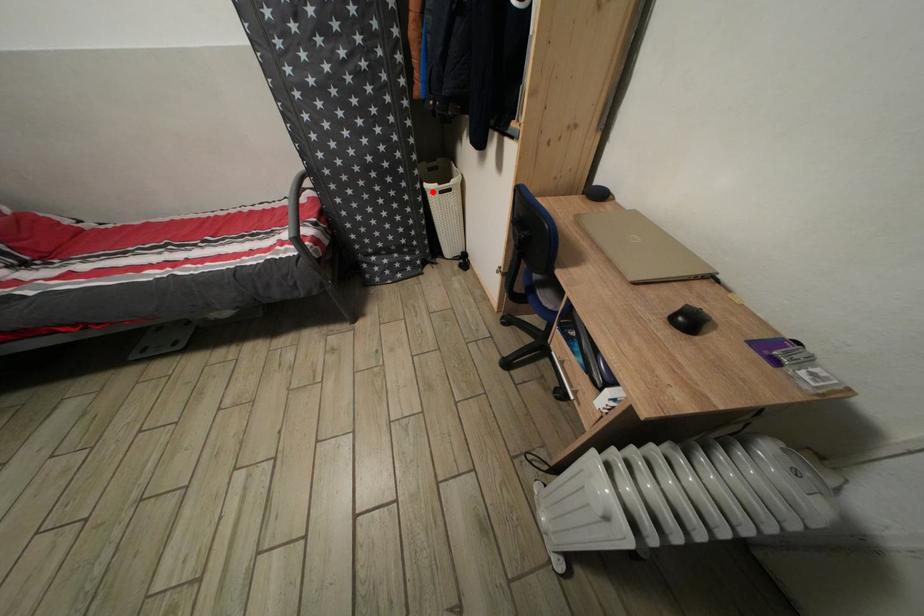
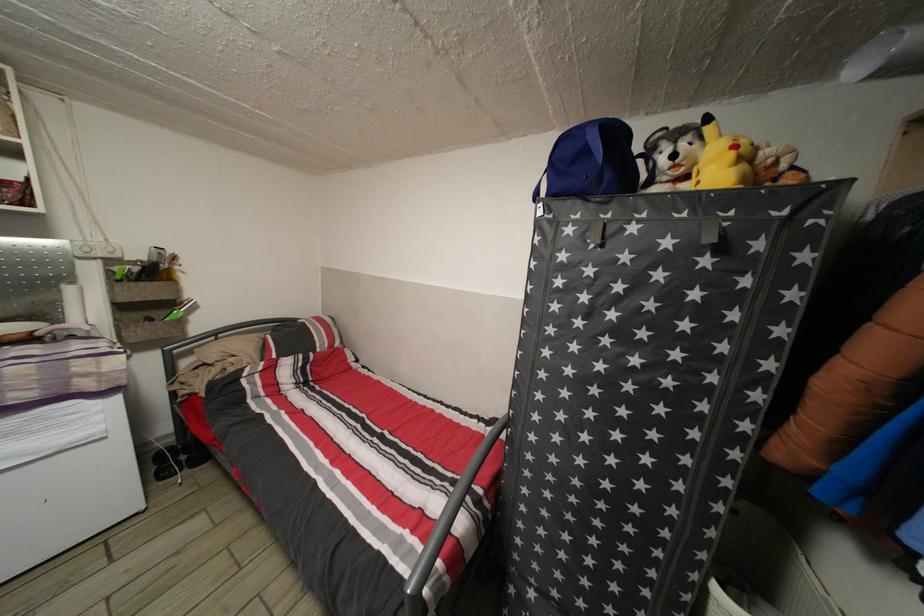
The point at the highlighted location is marked in the first image. Where is the corresponding point in the second image?

(723, 594)